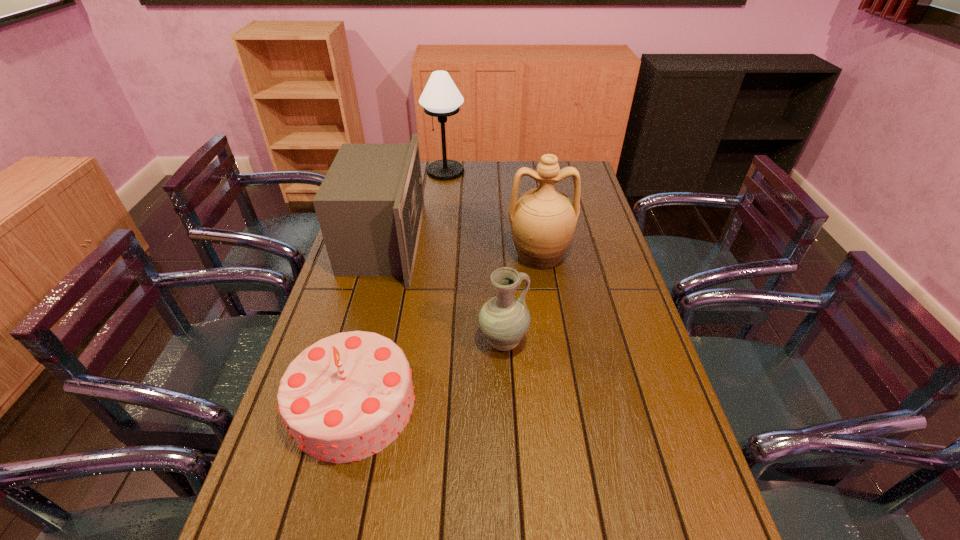
Image resolution: width=960 pixels, height=540 pixels. In order to click on object located at the far edge in this screenshot , I will do coord(441,98).

Where is `microwave oven located at the left edge`? microwave oven located at the left edge is located at coordinates (370, 205).

You are a GUI agent. You are given a task and a screenshot of the screen. Output one action in this format:
    pyautogui.click(x=<x>, y=<y>)
    Task: Click on the birthday cake that is at the left edge
    This screenshot has width=960, height=540.
    Given the screenshot: What is the action you would take?
    pyautogui.click(x=346, y=397)

Where is `object that is at the right edge`? The height and width of the screenshot is (540, 960). object that is at the right edge is located at coordinates (543, 220).

Locate an element on the screen. The image size is (960, 540). vacant region at the far edge is located at coordinates (477, 174).

In the image, there is a desktop. Identify the location of vacant space at the left edge. (271, 467).

Locate an element on the screen. This screenshot has width=960, height=540. vacant space at the right edge of the desktop is located at coordinates (631, 470).

Locate an element on the screen. The image size is (960, 540). free space at the far right corner is located at coordinates (564, 183).

At what (x,y) coordinates should I click in order to perform the action: click on free space between the nearer pitcher and the birthday cake. Please return your answer as a coordinate pair (x, y). Looking at the image, I should click on (428, 373).

Find the location of `free space between the table lamp and the nearer pitcher`. free space between the table lamp and the nearer pitcher is located at coordinates (474, 256).